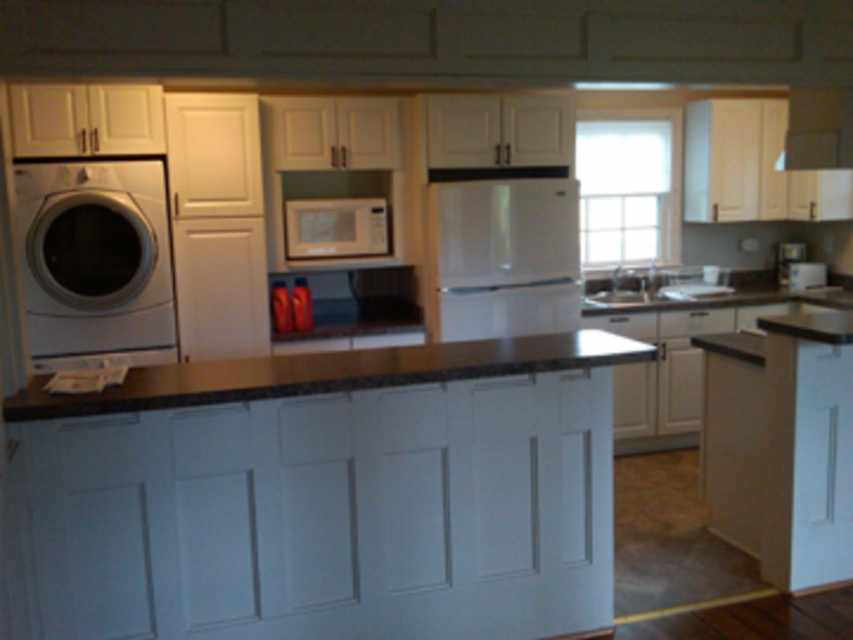
Between white glossy washing machine at left and black granite countertop at center, which one has less height?

With less height is black granite countertop at center.

Is point (56, 164) closer to camera compared to point (314, 364)?

No.

This screenshot has height=640, width=853. What are the coordinates of `white glossy washing machine at left` in the screenshot? It's located at (94, 259).

Which of these two, white glossy washing machine at left or satin white refrigerator at center, stands taller?

white glossy washing machine at left is taller.

Measure the distance between white glossy washing machine at left and satin white refrigerator at center.

white glossy washing machine at left and satin white refrigerator at center are 1.67 meters apart.

Does point (119, 301) lie behind point (428, 216)?

No, (119, 301) is closer to viewer.

This screenshot has width=853, height=640. Find the location of `white glossy washing machine at left`. white glossy washing machine at left is located at coordinates (94, 259).

Between white glossy sink at center and white glossy sink at center right, which one has less height?

With less height is white glossy sink at center right.

You are a GUI agent. You are given a task and a screenshot of the screen. Output one action in this format:
    pyautogui.click(x=<x>, y=<y>)
    Task: Click on the white glossy sink at center
    The width and height of the screenshot is (853, 640).
    Given the screenshot: What is the action you would take?
    pos(662,284)